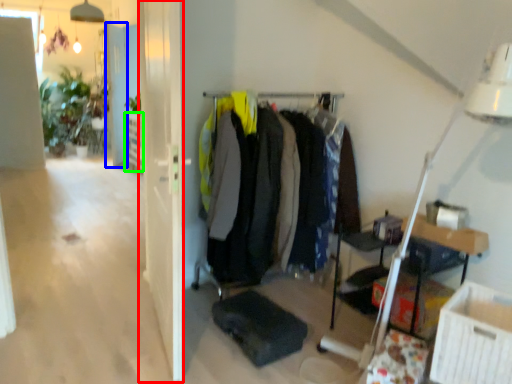
Question: Based on their relative distances, which object is nearer to glass door (highlighted by a red box)? Choose from door (highlighted by a blue box) and shelf (highlighted by a green box).

Choices:
 (A) door
 (B) shelf

Answer: (B)